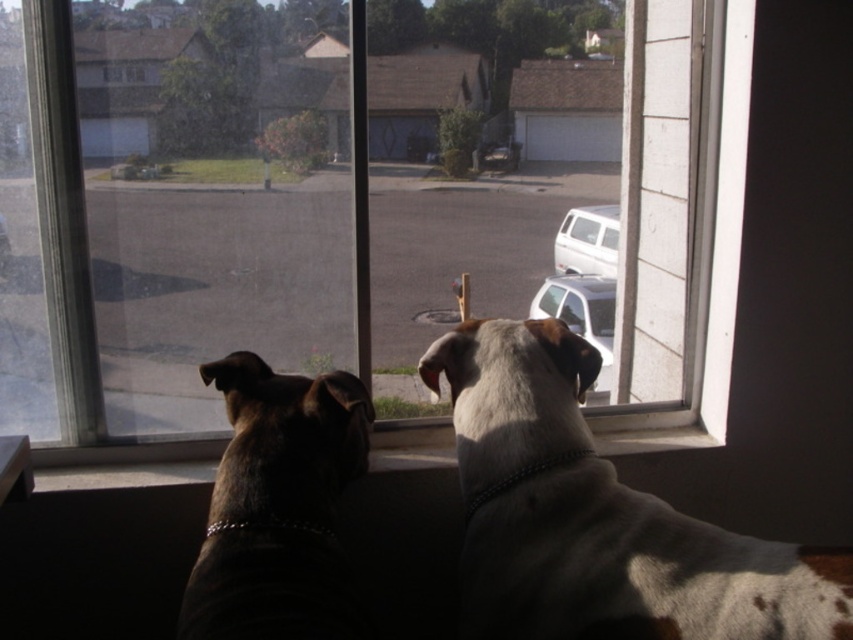
At what (x,y) coordinates should I click in order to perform the action: click on white plastic window sill at lower center. Please return your answer as a coordinate pair (x, y). Image resolution: width=853 pixels, height=640 pixels. Looking at the image, I should click on (131, 451).

Which of these two, white plastic window sill at lower center or white glossy car at center, stands taller?

With more height is white glossy car at center.

Identify the location of white plastic window sill at lower center. The image size is (853, 640). (131, 451).

Is transparent glass window at center shorter than black leather dog at left?

Yes.

Does transparent glass window at center have a greater width compared to black leather dog at left?

→ No, transparent glass window at center is not wider than black leather dog at left.

Is point (643, 339) positioned before point (234, 365)?

No, (643, 339) is further to viewer.

I want to click on transparent glass window at center, so click(251, 237).

Where is `black leather dog at left`? black leather dog at left is located at coordinates click(x=277, y=508).

The image size is (853, 640). In order to click on black leather dog at left in this screenshot , I will do `click(277, 508)`.